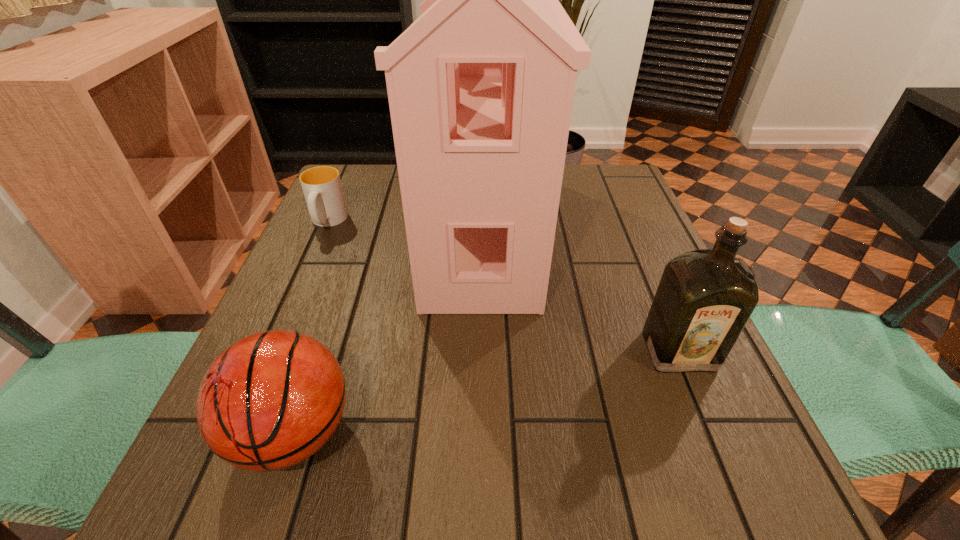
The width and height of the screenshot is (960, 540). In order to click on the tallest object in this screenshot , I will do `click(480, 87)`.

Find the location of a particular element. This screenshot has height=540, width=960. dollhouse is located at coordinates (480, 87).

This screenshot has height=540, width=960. In order to click on liquor in this screenshot , I will do tap(704, 299).

The width and height of the screenshot is (960, 540). What are the coordinates of `the rightmost object` in the screenshot? It's located at (704, 299).

You are a GUI agent. You are given a task and a screenshot of the screen. Output one action in this format:
    pyautogui.click(x=<x>, y=<y>)
    Task: Click on the nearest object
    The height and width of the screenshot is (540, 960).
    Given the screenshot: What is the action you would take?
    pyautogui.click(x=271, y=400)

Where is `basketball`? The width and height of the screenshot is (960, 540). basketball is located at coordinates 271,400.

What are the coordinates of `the shortest object` in the screenshot? It's located at (322, 188).

This screenshot has height=540, width=960. What are the coordinates of `free region located 0.050m on the front-facing side of the second object from right to left` in the screenshot? It's located at (405, 228).

Locate an element on the screen. vacant area situated on the front-facing side of the second object from right to left is located at coordinates (348, 228).

Identify the location of free spot located 0.060m on the front-facing side of the second object from right to left. Image resolution: width=960 pixels, height=540 pixels. (401, 228).